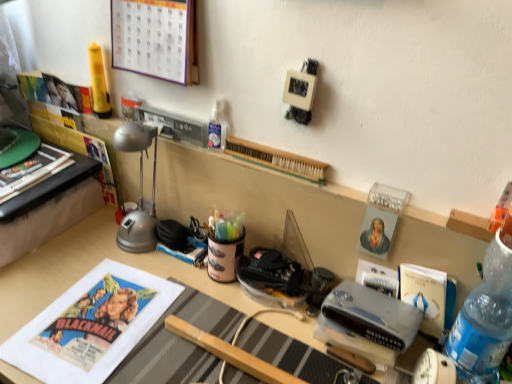
Question: Would you say blue plastic bottle at right is to the left or to the right of hardcover book at center, positioned as the second paperback book in right-to-left order, in the picture?

Choices:
 (A) left
 (B) right

Answer: (B)

Question: Would you say blue plastic bottle at right is inside or outside hardcover book at center, positioned as the second paperback book in right-to-left order?

Choices:
 (A) inside
 (B) outside

Answer: (B)

Question: Which of these objects is positioned closest to the wooden desk at center?

Choices:
 (A) silver metallic desk lamp at left
 (B) blue plastic bottle at right
 (C) blue matte paperback book at center-right, the second paperback book positioned from the left
 (D) matte paper calendar at upper left
 (E) white paper poster at center

Answer: (E)

Question: Considering the real-world distances, which object is closest to the blue matte paperback book at center-right, which is the 1th paperback book from right to left?

Choices:
 (A) hardcover book at center, positioned as the second paperback book in right-to-left order
 (B) wooden toothbrush at center
 (C) matte paper calendar at upper left
 (D) blue plastic bottle at right
 (E) white paper poster at center

Answer: (A)